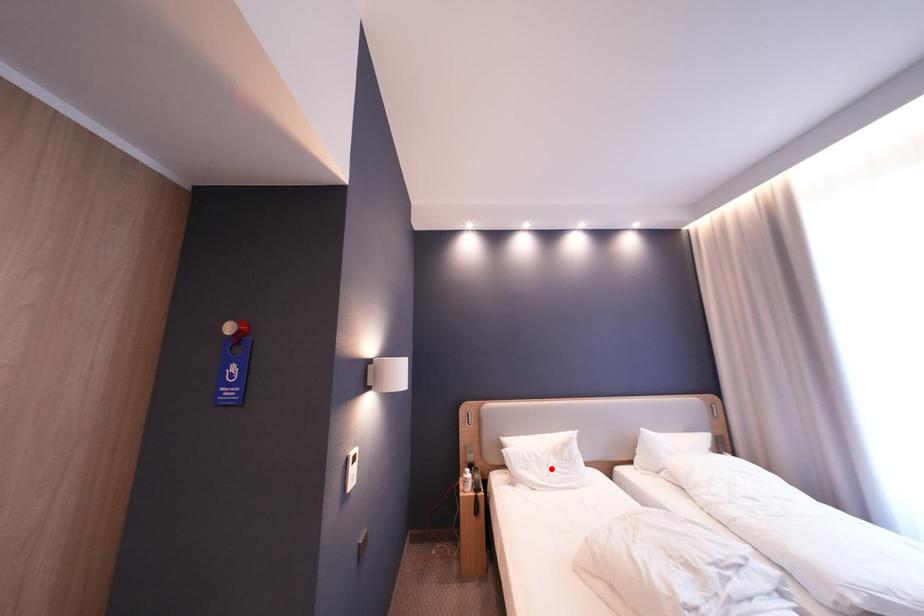
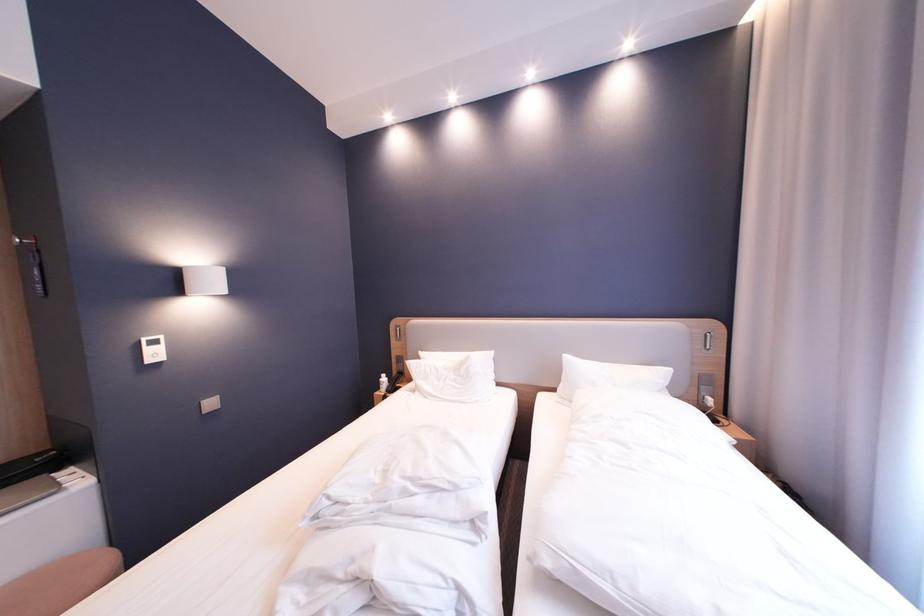
Locate, in the second image, the point that corresponds to the highlighted location in the first image.

(450, 382)